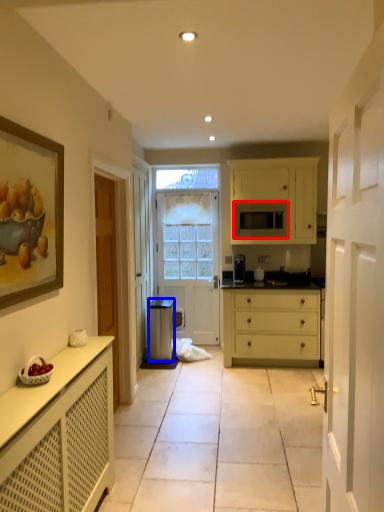
Question: Among these objects, which one is farthest to the camera, microwave oven (highlighted by a red box) or trash bin/can (highlighted by a blue box)?

Choices:
 (A) microwave oven
 (B) trash bin/can

Answer: (A)